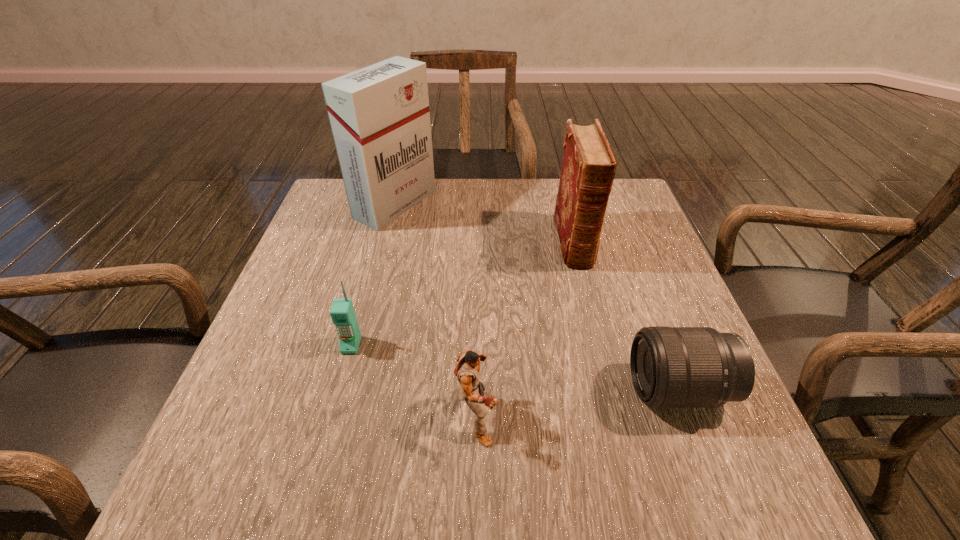
Where is `vacant space located on the keypad of the cellular telephone`? vacant space located on the keypad of the cellular telephone is located at coordinates (326, 437).

At what (x,y) coordinates should I click in order to perform the action: click on free space located on the surface of the rightmost object. Please return your answer as a coordinate pair (x, y). This screenshot has width=960, height=540. Looking at the image, I should click on (560, 389).

Locate an element on the screen. free location located on the surface of the rightmost object is located at coordinates (532, 389).

Find the location of a particular element. The image size is (960, 540). vacant region located on the surface of the rightmost object is located at coordinates (582, 389).

Locate an element on the screen. cigarette case that is at the far edge is located at coordinates (379, 115).

You are a GUI agent. You are given a task and a screenshot of the screen. Output one action in this format:
    pyautogui.click(x=<x>, y=<y>)
    Task: Click on the hardback book situated at the far edge
    This screenshot has height=540, width=960.
    Given the screenshot: What is the action you would take?
    pyautogui.click(x=588, y=167)

Image resolution: width=960 pixels, height=540 pixels. In order to click on object present at the left edge in this screenshot , I will do `click(379, 115)`.

The width and height of the screenshot is (960, 540). What are the coordinates of `object that is at the right edge` in the screenshot? It's located at (671, 367).

At what (x,y) coordinates should I click in order to perform the action: click on object situated at the far left corner. Please return your answer as a coordinate pair (x, y). The height and width of the screenshot is (540, 960). Looking at the image, I should click on (379, 115).

In the image, there is a desktop. At what (x,y) coordinates should I click in order to perform the action: click on free region at the far edge. Please return your answer as a coordinate pair (x, y). The width and height of the screenshot is (960, 540). Looking at the image, I should click on (462, 194).